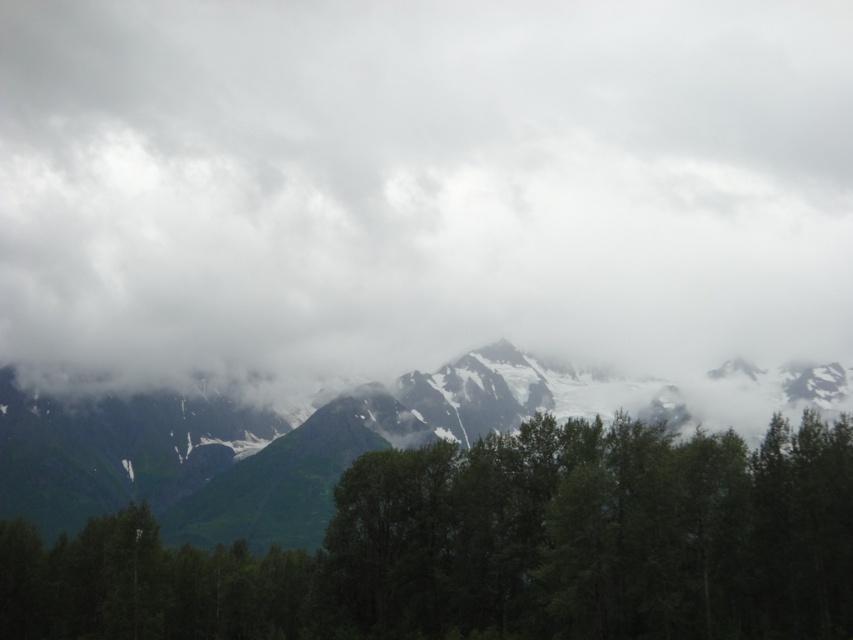
You are a hiker who wants to capture a photo of the green grassy mountain range at center without any clouds obstructing the view. Based on the scene, is there a position you can stand where the white fluffy cloud at upper center won

The white fluffy cloud at upper center is located to the right of the green grassy mountain range at center. To avoid the cloud obstructing the view, you can position yourself to the left side of the mountain range so that the cloud is out of frame or behind the mountains.

You are standing in the mountainous landscape and want to take a photo. You notice two points in the scene labeled as point (x=286, y=29) and point (x=490, y=385). Which point should you focus on first if you want to capture the closest object in your frame?

Point (x=286, y=29) is further to the camera than point (x=490, y=385). Therefore, to capture the closest object, you should focus on point (x=490, y=385) first.

You are a photographer standing at the base of the mountain, aiming to capture the white fluffy cloud at upper center in your shot. The camera you are using has a maximum focus range of 600 meters. Will the cloud be in focus?

The white fluffy cloud at upper center is 622.83 meters away from the camera, which exceeds the maximum focus range of 600 meters. Therefore, the cloud will not be in focus.